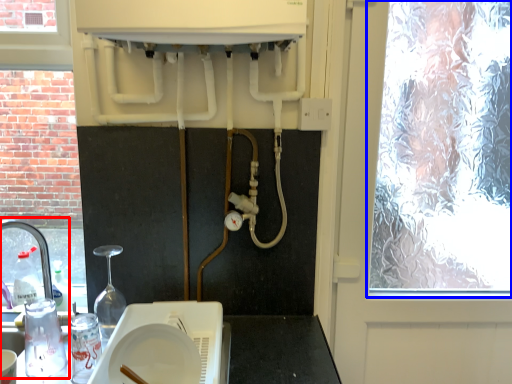
Question: Which object is further to the camera taking this photo, sink (highlighted by a red box) or window (highlighted by a blue box)?

Choices:
 (A) sink
 (B) window

Answer: (B)